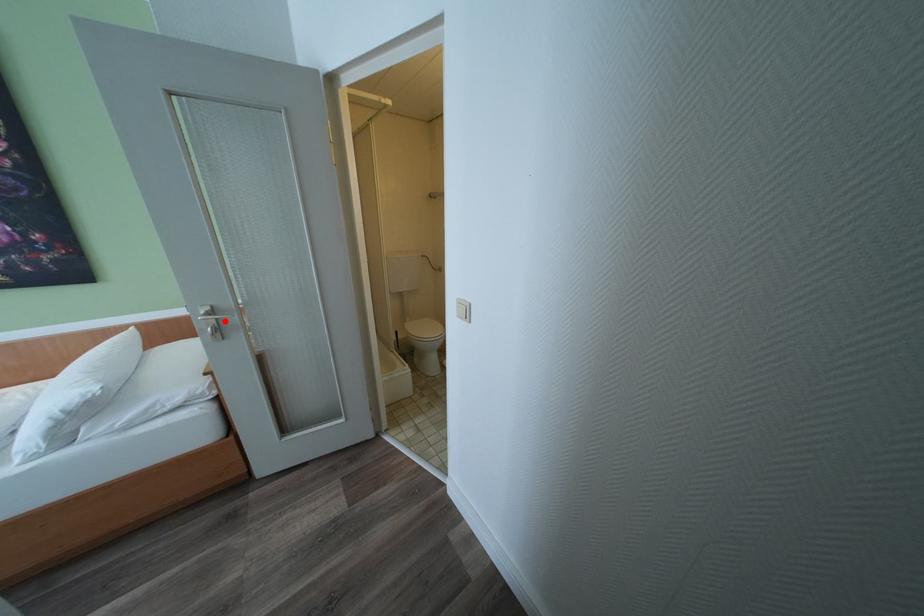
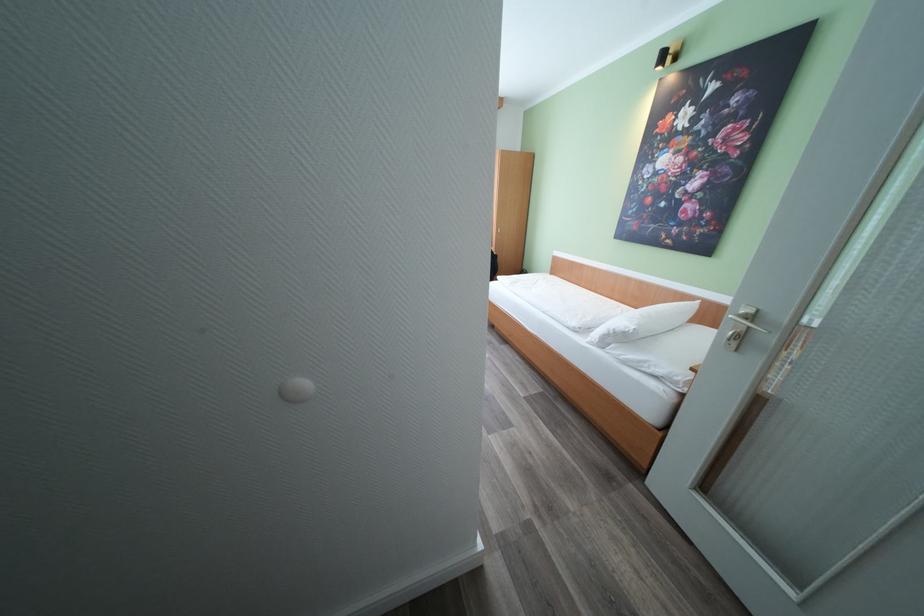
Find the pixel in the second image that matches the highlighted location in the first image.

(756, 329)